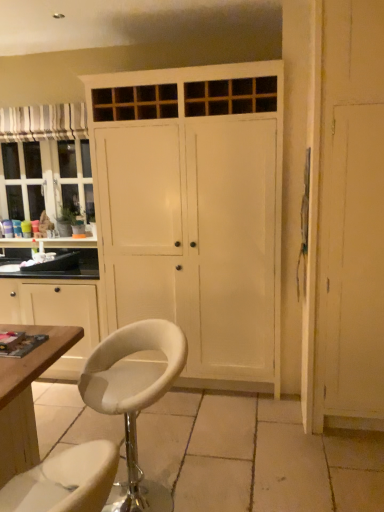
Question: Does wooden cabinet at left have a lesser width compared to wooden screen door at right?

Choices:
 (A) yes
 (B) no

Answer: (B)

Question: Does wooden cabinet at left have a greater height compared to wooden screen door at right?

Choices:
 (A) no
 (B) yes

Answer: (A)

Question: Is the depth of wooden cabinet at left greater than that of wooden screen door at right?

Choices:
 (A) no
 (B) yes

Answer: (B)

Question: From the image's perspective, would you say wooden cabinet at left is positioned over wooden screen door at right?

Choices:
 (A) yes
 (B) no

Answer: (B)

Question: From a real-world perspective, is wooden cabinet at left below wooden screen door at right?

Choices:
 (A) yes
 (B) no

Answer: (A)

Question: Is wooden cabinet at left closer to camera compared to wooden screen door at right?

Choices:
 (A) yes
 (B) no

Answer: (B)

Question: Considering the relative sizes of white painted wood cupboard at center and wooden screen door at right in the image provided, is white painted wood cupboard at center shorter than wooden screen door at right?

Choices:
 (A) no
 (B) yes

Answer: (A)

Question: From a real-world perspective, is white painted wood cupboard at center positioned under wooden screen door at right based on gravity?

Choices:
 (A) yes
 (B) no

Answer: (B)

Question: Is white painted wood cupboard at center beside wooden screen door at right?

Choices:
 (A) no
 (B) yes

Answer: (A)

Question: Are white painted wood cupboard at center and wooden screen door at right far apart?

Choices:
 (A) no
 (B) yes

Answer: (A)

Question: Is white painted wood cupboard at center wider than wooden screen door at right?

Choices:
 (A) no
 (B) yes

Answer: (B)

Question: Is white painted wood cupboard at center bigger than wooden screen door at right?

Choices:
 (A) yes
 (B) no

Answer: (A)

Question: Is striped fabric curtain at upper left facing away from white painted wood cupboard at center?

Choices:
 (A) no
 (B) yes

Answer: (A)